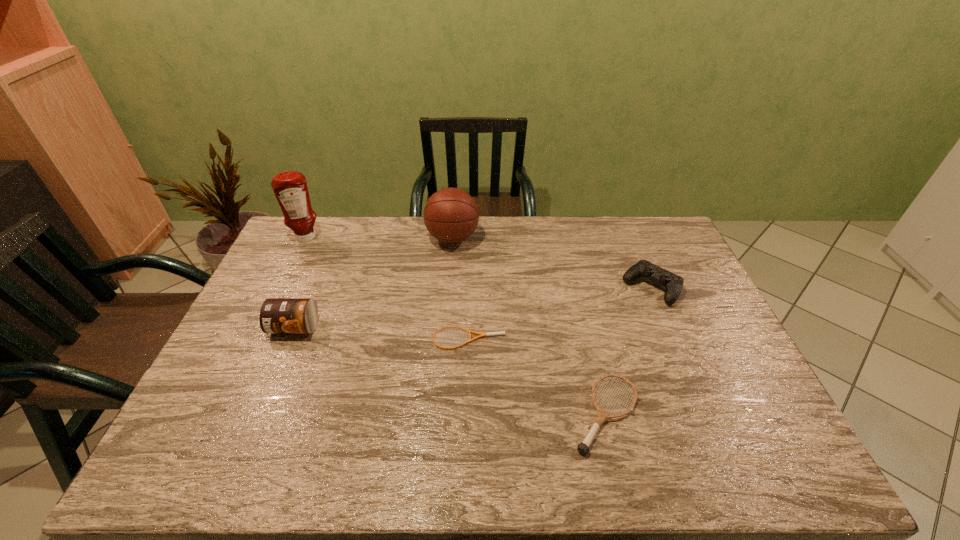
At what (x,y) coordinates should I click in order to perform the action: click on blank space that satisfies the following two spatial constraints: 1. on the front side of the fifth shortest object; 2. on the left side of the shorter tennis racket. Please return your answer as a coordinate pair (x, y). Looking at the image, I should click on (444, 339).

In order to click on vacant space that satisfies the following two spatial constraints: 1. on the front label of the can; 2. on the right side of the shortest object in this screenshot , I will do `click(289, 339)`.

I want to click on vacant space that satisfies the following two spatial constraints: 1. on the front label of the third tallest object; 2. on the left side of the taller tennis racket, so click(258, 414).

Where is `vacant space that satisfies the following two spatial constraints: 1. on the front side of the third farthest object; 2. on the left side of the basketball`? The width and height of the screenshot is (960, 540). vacant space that satisfies the following two spatial constraints: 1. on the front side of the third farthest object; 2. on the left side of the basketball is located at coordinates (448, 288).